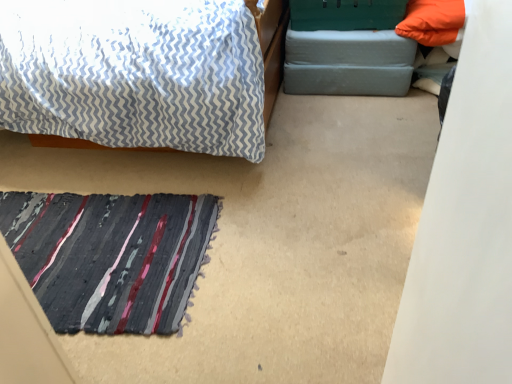
Looking at this image, in order to face textured striped mat at lower left, should I rotate leftwards or rightwards?

You should look left and rotate roughly 23.505 degrees.

Where is `textured striped mat at lower left`? textured striped mat at lower left is located at coordinates (110, 256).

Describe the element at coordinates (110, 256) in the screenshot. I see `textured striped mat at lower left` at that location.

Measure the distance between point (407, 90) and camera.

Point (407, 90) is 7.42 feet away from camera.

What do you see at coordinates (348, 62) in the screenshot? The image size is (512, 384). I see `gray fabric footrest at upper right` at bounding box center [348, 62].

Locate an element on the screen. Image resolution: width=512 pixels, height=384 pixels. gray fabric footrest at upper right is located at coordinates (348, 62).

Locate an element on the screen. textured striped mat at lower left is located at coordinates (110, 256).

Which object is positioned more to the right, textured striped mat at lower left or gray fabric footrest at upper right?

gray fabric footrest at upper right is more to the right.

Considering the positions of objects textured striped mat at lower left and gray fabric footrest at upper right in the image provided, who is in front, textured striped mat at lower left or gray fabric footrest at upper right?

textured striped mat at lower left is in front.

Does point (162, 272) come farther from viewer compared to point (340, 36)?

No, it is not.

From the image's perspective, is textured striped mat at lower left below gray fabric footrest at upper right?

Yes, from the image's perspective, textured striped mat at lower left is beneath gray fabric footrest at upper right.

From a real-world perspective, is textured striped mat at lower left located beneath gray fabric footrest at upper right?

Yes, from a real-world perspective, textured striped mat at lower left is beneath gray fabric footrest at upper right.

Looking at their sizes, would you say textured striped mat at lower left is wider or thinner than gray fabric footrest at upper right?

Clearly, textured striped mat at lower left has more width compared to gray fabric footrest at upper right.

Is textured striped mat at lower left taller or shorter than gray fabric footrest at upper right?

In the image, textured striped mat at lower left appears to be shorter than gray fabric footrest at upper right.

Between textured striped mat at lower left and gray fabric footrest at upper right, which one has smaller size?

textured striped mat at lower left.

Can we say textured striped mat at lower left lies outside gray fabric footrest at upper right?

Yes, textured striped mat at lower left is located beyond the bounds of gray fabric footrest at upper right.

Are textured striped mat at lower left and gray fabric footrest at upper right beside each other?

There is a gap between textured striped mat at lower left and gray fabric footrest at upper right.

Is gray fabric footrest at upper right at the back of textured striped mat at lower left?

No, gray fabric footrest at upper right is not at the back of textured striped mat at lower left.

How many degrees apart are the facing directions of textured striped mat at lower left and gray fabric footrest at upper right?

95.8 degrees.

Locate an element on the screen. mat in front of the gray fabric footrest at upper right is located at coordinates (110, 256).

Considering the relative positions of gray fabric footrest at upper right and textured striped mat at lower left in the image provided, is gray fabric footrest at upper right to the left or to the right of textured striped mat at lower left?

Clearly, gray fabric footrest at upper right is on the right of textured striped mat at lower left in the image.

Based on the photo, in the image, is gray fabric footrest at upper right positioned in front of or behind textured striped mat at lower left?

Visually, gray fabric footrest at upper right is located behind textured striped mat at lower left.

Is point (392, 48) positioned after point (117, 202)?

Yes.

From the image's perspective, is gray fabric footrest at upper right above textured striped mat at lower left?

Yes, from the image's perspective, gray fabric footrest at upper right is over textured striped mat at lower left.

From a real-world perspective, is gray fabric footrest at upper right above or below textured striped mat at lower left?

From a real-world perspective, gray fabric footrest at upper right is physically above textured striped mat at lower left.

Considering the sizes of objects gray fabric footrest at upper right and textured striped mat at lower left in the image provided, who is thinner, gray fabric footrest at upper right or textured striped mat at lower left?

gray fabric footrest at upper right.

Considering the relative sizes of gray fabric footrest at upper right and textured striped mat at lower left in the image provided, is gray fabric footrest at upper right shorter than textured striped mat at lower left?

In fact, gray fabric footrest at upper right may be taller than textured striped mat at lower left.

From the picture: Considering the relative sizes of gray fabric footrest at upper right and textured striped mat at lower left in the image provided, is gray fabric footrest at upper right bigger than textured striped mat at lower left?

Yes.

Is gray fabric footrest at upper right inside the boundaries of textured striped mat at lower left, or outside?

gray fabric footrest at upper right exists outside the volume of textured striped mat at lower left.

Is gray fabric footrest at upper right far from textured striped mat at lower left?

Absolutely, gray fabric footrest at upper right is distant from textured striped mat at lower left.

Is gray fabric footrest at upper right facing away from textured striped mat at lower left?

gray fabric footrest at upper right is not turned away from textured striped mat at lower left.

Based on the photo, what's the angular difference between gray fabric footrest at upper right and textured striped mat at lower left's facing directions?

The facing directions of gray fabric footrest at upper right and textured striped mat at lower left are 95.8 degrees apart.

This screenshot has height=384, width=512. In order to click on footrest behind the textured striped mat at lower left in this screenshot , I will do `click(348, 62)`.

Image resolution: width=512 pixels, height=384 pixels. What are the coordinates of `mat in front of the gray fabric footrest at upper right` in the screenshot? It's located at (110, 256).

Where is `mat that appears below the gray fabric footrest at upper right (from the image's perspective)`? mat that appears below the gray fabric footrest at upper right (from the image's perspective) is located at coordinates (110, 256).